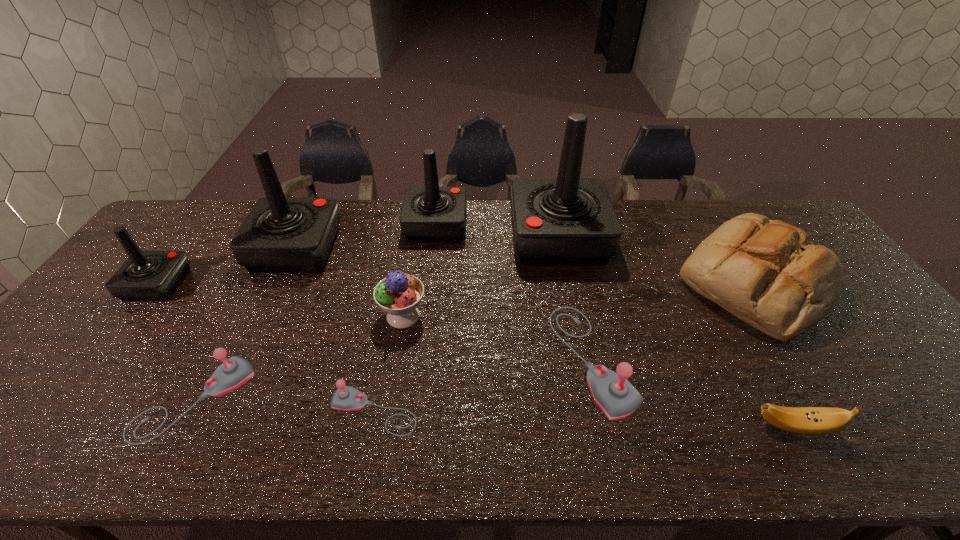
Locate which red joystick is the closest to the third red joystick from right to left. Please provide its 2D coordinates. Your answer should be formatted as a tuple, i.e. [(x, y)], where the tuple contains the x and y coordinates of a point satisfying the conditions above.

[(146, 275)]

Locate an element on the screen. Image resolution: width=960 pixels, height=540 pixels. red joystick that is the closest one to the ninth shortest object is located at coordinates (146, 275).

You are a GUI agent. You are given a task and a screenshot of the screen. Output one action in this format:
    pyautogui.click(x=<x>, y=<y>)
    Task: Click on the gray joystick that is the third closest to the bread
    
    Given the screenshot: What is the action you would take?
    pyautogui.click(x=233, y=372)

Locate an element on the screen. the closest gray joystick to the leftmost joystick is located at coordinates click(x=233, y=372).

At what (x,y) coordinates should I click in order to perform the action: click on free space that satisfies the following two spatial constraints: 1. on the front-facing side of the rightmost red joystick; 2. on the right side of the bread. Please return your answer as a coordinate pair (x, y). Looking at the image, I should click on (567, 283).

What are the coordinates of `vacant area in the image that satisfies the following two spatial constraints: 1. on the back side of the biggest gray joystick; 2. on the front-facing side of the fourth shortest joystick` in the screenshot? It's located at (575, 285).

Where is `vacant space that satisfies the following two spatial constraints: 1. on the front-facing side of the rightmost gray joystick; 2. on the left side of the leftmost joystick`? This screenshot has width=960, height=540. vacant space that satisfies the following two spatial constraints: 1. on the front-facing side of the rightmost gray joystick; 2. on the left side of the leftmost joystick is located at coordinates [103, 359].

Identify the location of vacant space that satisfies the following two spatial constraints: 1. on the front-facing side of the second biggest red joystick; 2. on the back side of the bread. This screenshot has width=960, height=540. (280, 283).

Find the location of a particular element. free spot that satisfies the following two spatial constraints: 1. on the back side of the seventh tallest object; 2. on the front-facing side of the third smallest red joystick is located at coordinates (567, 248).

I want to click on blank space that satisfies the following two spatial constraints: 1. on the front-facing side of the shortest joystick; 2. on the right side of the second tallest object, so click(221, 411).